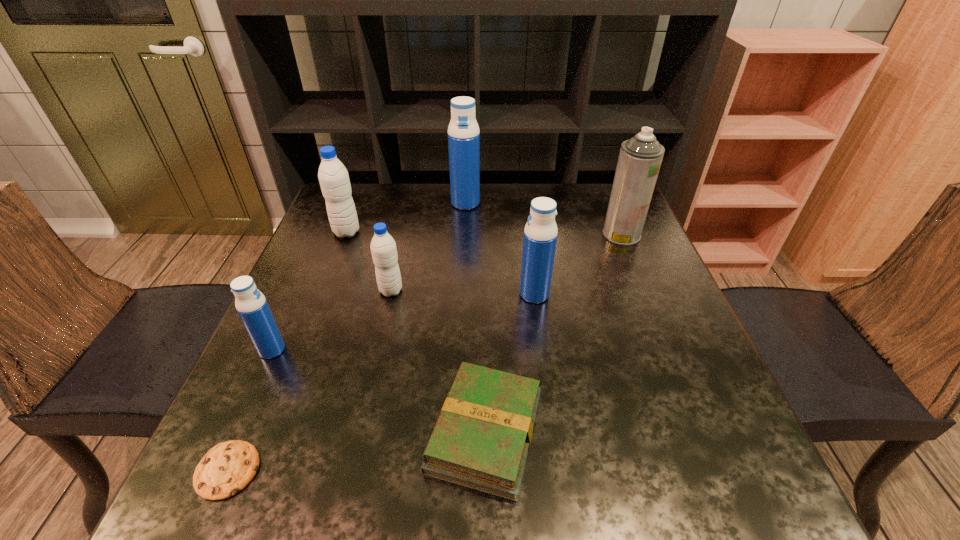
Locate an element on the screen. vacant region between the third water bottle from left to right and the shortest object is located at coordinates (309, 381).

Where is `free spot between the yellow book and the cookie`? This screenshot has width=960, height=540. free spot between the yellow book and the cookie is located at coordinates (356, 451).

The image size is (960, 540). Find the location of `vacant region between the fourth nearest water bottle and the second blue water bottle from right to left`. vacant region between the fourth nearest water bottle and the second blue water bottle from right to left is located at coordinates (406, 218).

Locate an element on the screen. free spot between the shortest object and the second farthest blue water bottle is located at coordinates (381, 382).

Find the location of a particular element. blank region between the rightmost water bottle and the third water bottle from right to left is located at coordinates (463, 293).

Locate which object is the second closest to the fifth object from right to left. Please provide its 2D coordinates. Your answer should be formatted as a tuple, i.e. [(x, y)], where the tuple contains the x and y coordinates of a point satisfying the conditions above.

[(254, 311)]

The height and width of the screenshot is (540, 960). In order to click on the third closest object relative to the cookie in this screenshot , I will do `click(383, 247)`.

Where is `water bottle that stands as the third closest to the nearest water bottle`? water bottle that stands as the third closest to the nearest water bottle is located at coordinates (540, 234).

Identify which water bottle is located as the third nearest to the second water bottle from right to left. Please provide its 2D coordinates. Your answer should be formatted as a tuple, i.e. [(x, y)], where the tuple contains the x and y coordinates of a point satisfying the conditions above.

[(540, 234)]

The image size is (960, 540). In order to click on blue water bottle that can be found as the third closest to the shortest object in this screenshot , I will do `click(463, 131)`.